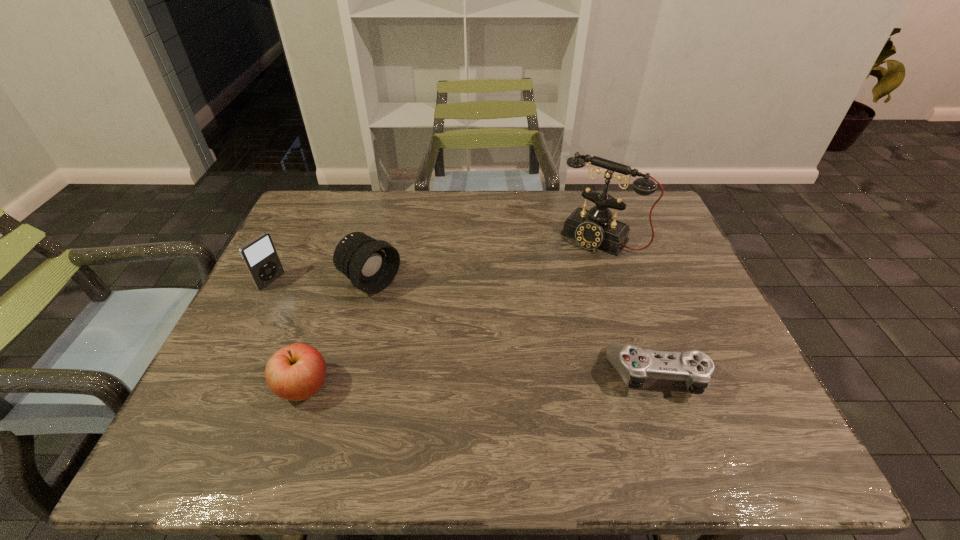
Image resolution: width=960 pixels, height=540 pixels. I want to click on free spot on the desktop that is between the second shortest object and the shortest object and is positioned on the front-facing side of the iPod, so click(x=461, y=381).

Find the location of a particular element. The image size is (960, 540). free space on the desktop that is between the second shortest object and the control and is positioned on the dial of the tallest object is located at coordinates (482, 381).

You are a GUI agent. You are given a task and a screenshot of the screen. Output one action in this format:
    pyautogui.click(x=<x>, y=<y>)
    Task: Click on the free space on the desktop that is between the fourth tallest object and the shortest object and is positioned at the front element of the telephoto lens
    
    Given the screenshot: What is the action you would take?
    pyautogui.click(x=517, y=380)